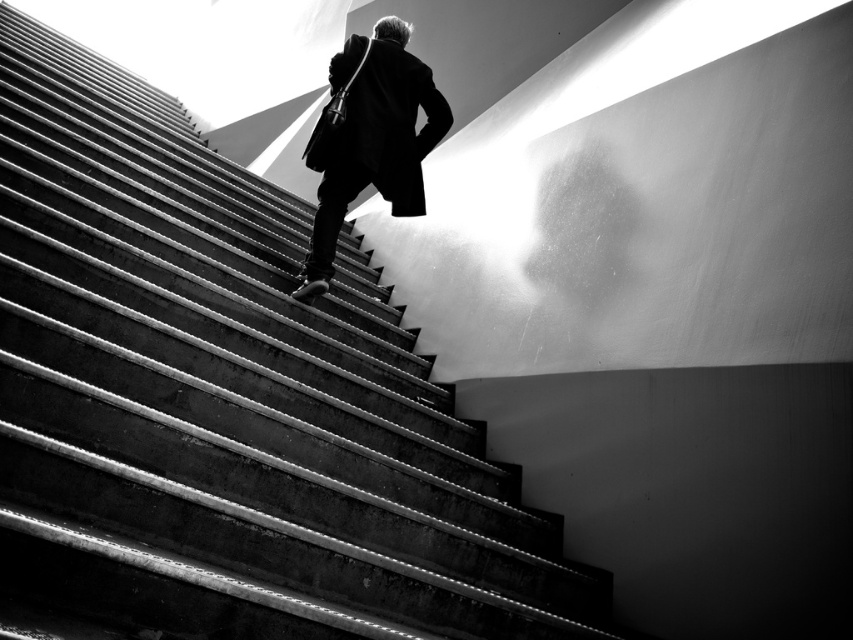
Does concrete stairs at center have a smaller size compared to black matte coat at center?

No, concrete stairs at center is not smaller than black matte coat at center.

Who is shorter, concrete stairs at center or black matte coat at center?

Standing shorter between the two is black matte coat at center.

In order to click on concrete stairs at center in this screenshot , I will do (222, 403).

At what (x,y) coordinates should I click in order to perform the action: click on concrete stairs at center. Please return your answer as a coordinate pair (x, y). The height and width of the screenshot is (640, 853). Looking at the image, I should click on (222, 403).